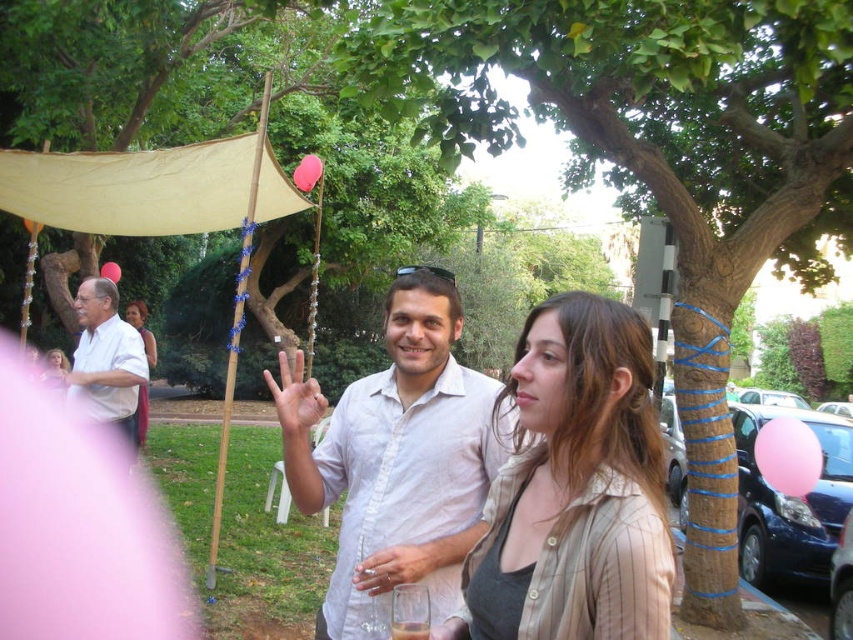
You are planning to hang a new decoration between the brown textured tree at center and the pink matte balloon at upper center. Given their current distance apart, how far apart should you place the decoration from each object to maintain equal distance?

To maintain equal distance between the decoration and both the brown textured tree at center and the pink matte balloon at upper center, you should place it exactly halfway between them. Since they are 11.27 feet apart, the decoration should be placed 5.635 feet away from each object.

You are a photographer trying to capture the brown textured tree at center from a specific angle. If your camera is positioned at the origin point of the coordinate system, what are the exact coordinates where the tree should be placed to align with your desired shot?

The brown textured tree at center should be placed at coordinates point (x=659, y=161) to align with the desired shot.

You are attending an outdoor event and notice the brown textured tree at center and the matte pink scarf at center. Which object is positioned higher in the scene?

The brown textured tree at center is located above the matte pink scarf at center, so it is positioned higher in the scene.